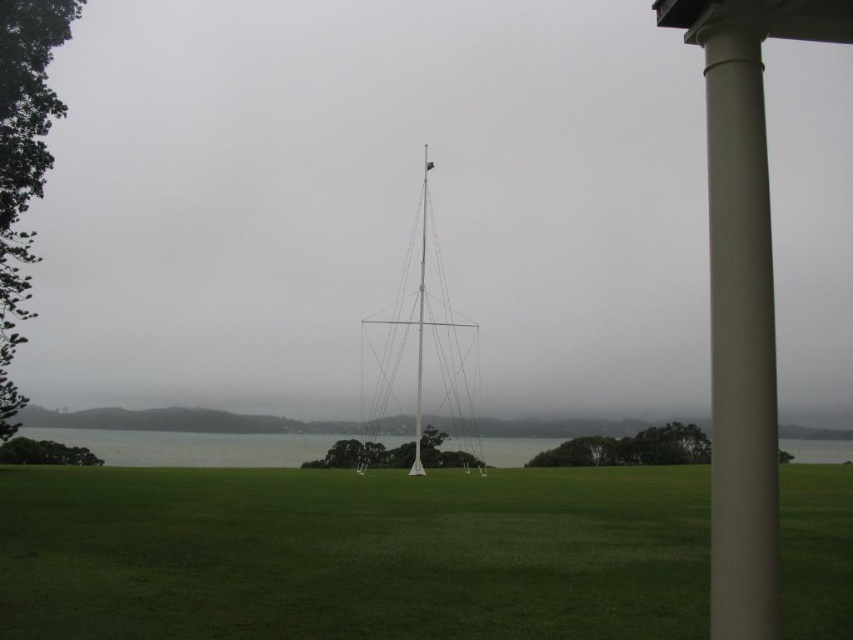
You are planning to place a new bench in the park. The bench requires a space that is larger than the satin beige column at right. Can the area around the white metallic sailboat at center accommodate it?

The satin beige column at right has a smaller size compared to the white metallic sailboat at center. Since the bench requires a space larger than the column, the area around the white metallic sailboat at center can accommodate it because the sailboat is larger and likely has more space around it.

You are a gardener planning to plant a row of flowers between the green grass at center and the white metallic flag pole at center. Can you fit the flowers in the space between them?

The green grass at center is wider than the white metallic flag pole at center, so there is enough space to plant flowers between them.

You are a photographer planning to take a photo of the white metallic sailboat at center and the satin beige column at right. Based on their positions, which object should appear higher in the photo?

The white metallic sailboat at center appears higher in the photo because the satin beige column at right is below it.